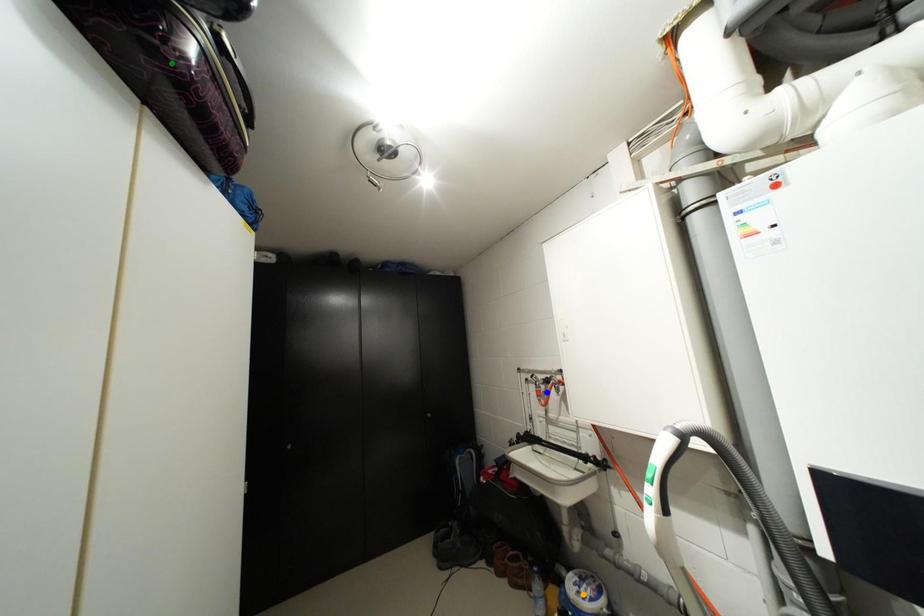
Order these from farthest to nearest:
1. orange point
2. green point
3. blue point

blue point < orange point < green point